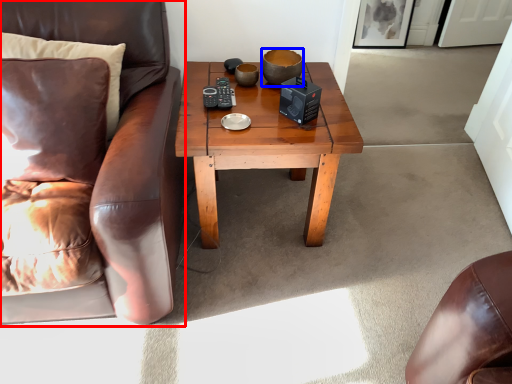
Question: Which point is further to the camera, chair (highlighted by a red box) or bowl (highlighted by a blue box)?

Choices:
 (A) chair
 (B) bowl

Answer: (B)